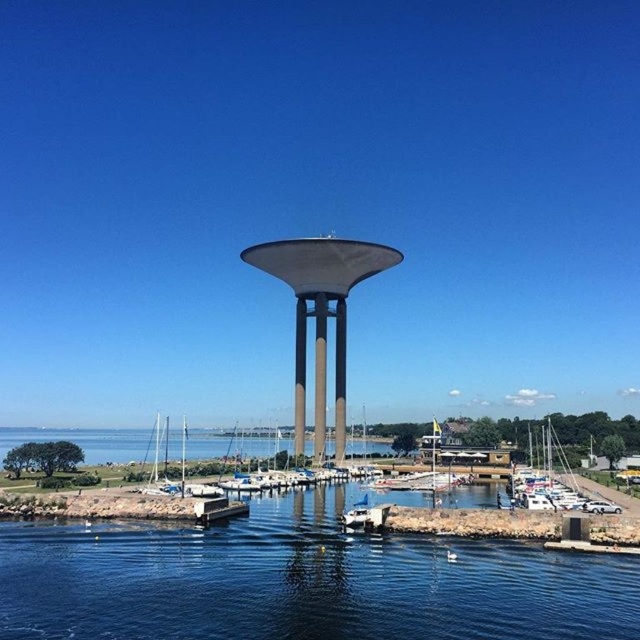
You are standing on the pier and want to take a photo of both the blue water at center and the matte gray pillar at center. Which object should you focus on first to ensure both are in sharp focus?

You should focus on the matte gray pillar at center first because it is farther away from the viewer than the blue water at center. By focusing on the farther object, the closer object will also be in focus due to the depth of field.

You are standing at the point closer to the camera between the two points, point 1 at coordinates (x=337, y=321) and point 2 at coordinates (x=305, y=323). Which point are you standing at?

You are standing at point 1 at coordinates (x=337, y=321) because it is further to the camera than point 2 at coordinates (x=305, y=323).